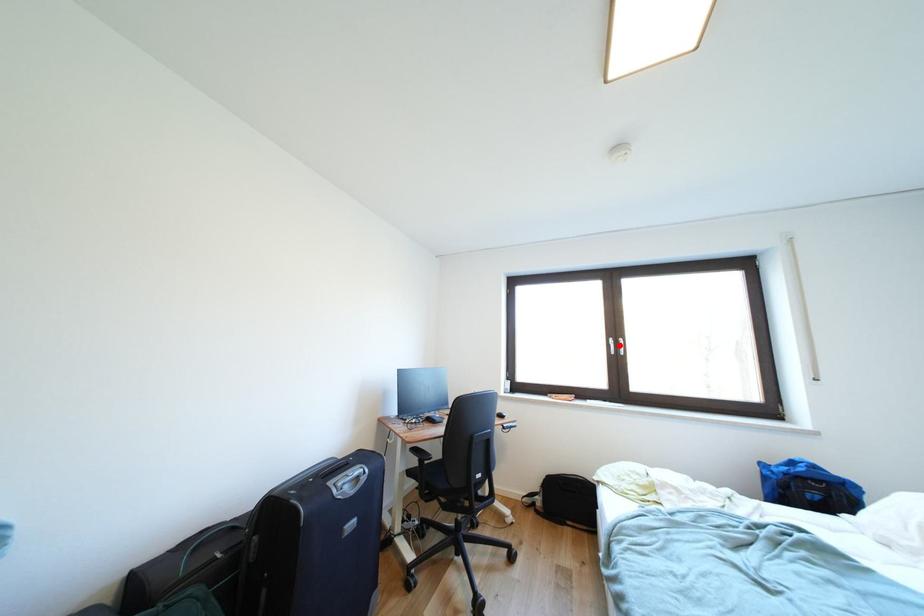
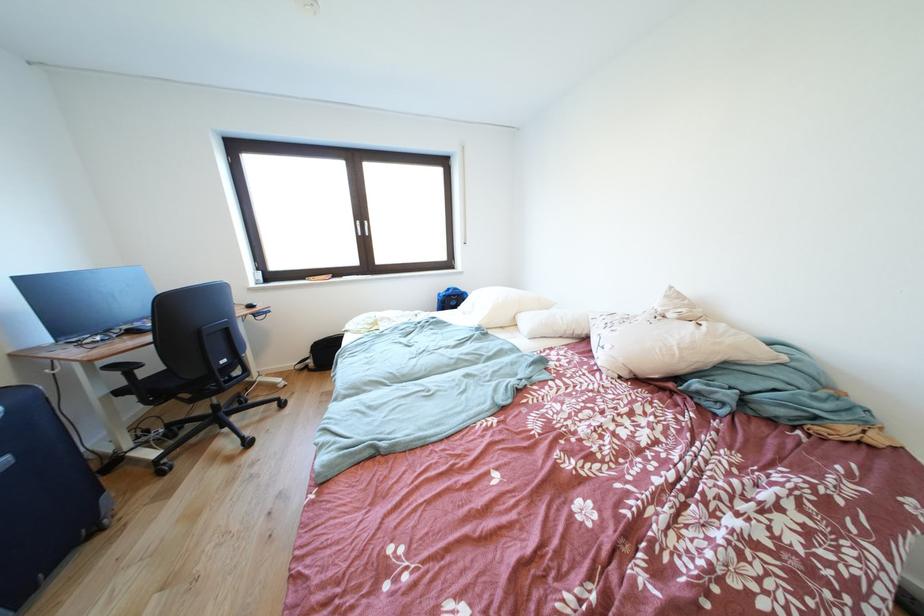
Question: I am providing you with two images of the same scene from different viewpoints. Image1 has a red point marked. In image2, the corresponding 3D location appears at what relative position? Reply with the corresponding letter.

Choices:
 (A) Closer
 (B) Farther

Answer: (A)